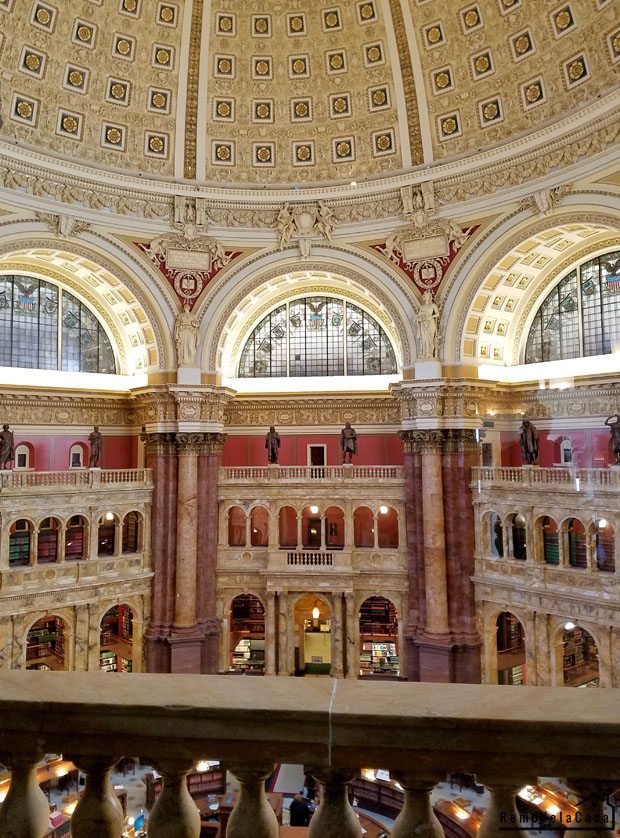
Find the location of `statue`. statue is located at coordinates (529, 443), (611, 447), (348, 442), (273, 446), (98, 449), (7, 453), (191, 344), (431, 328).